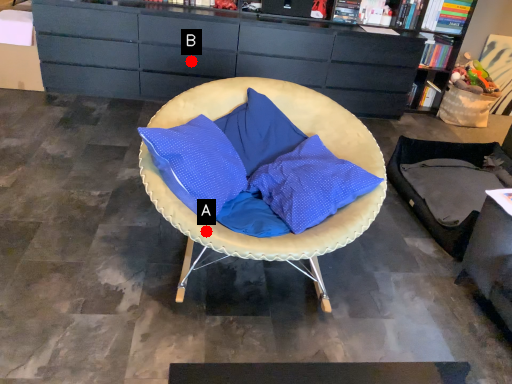
Question: Two points are circled on the image, labeled by A and B beside each circle. Which point appears farthest from the camera in this image?

Choices:
 (A) A is further
 (B) B is further

Answer: (B)